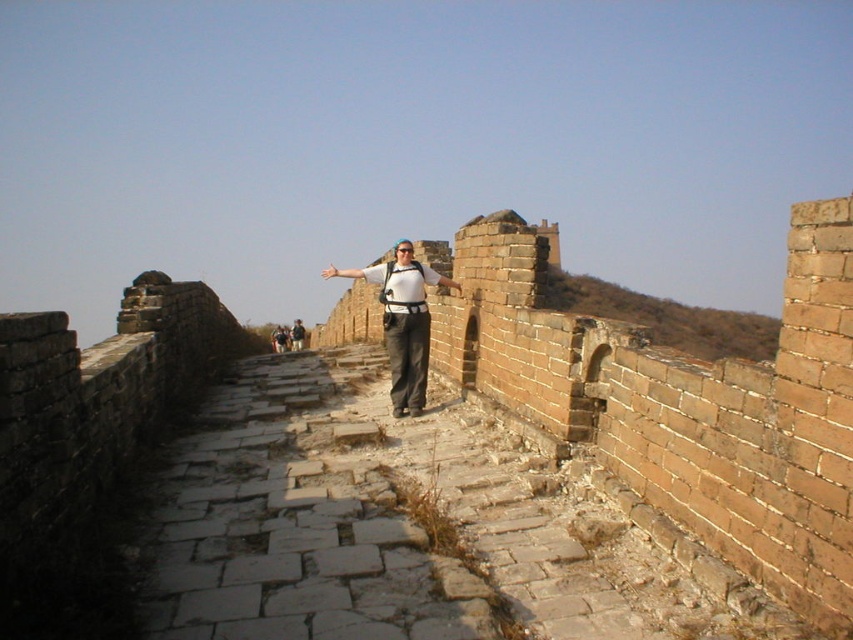
Question: Is matte white shirt at center to the left of matte gray pants at center from the viewer's perspective?

Choices:
 (A) no
 (B) yes

Answer: (A)

Question: Does matte white shirt at center have a larger size compared to matte gray pants at center?

Choices:
 (A) no
 (B) yes

Answer: (A)

Question: Which point is farther to the camera?

Choices:
 (A) matte gray pants at center
 (B) matte white shirt at center

Answer: (A)

Question: Is matte white shirt at center below matte gray pants at center?

Choices:
 (A) yes
 (B) no

Answer: (B)

Question: Among these points, which one is nearest to the camera?

Choices:
 (A) (300, 320)
 (B) (404, 330)

Answer: (B)